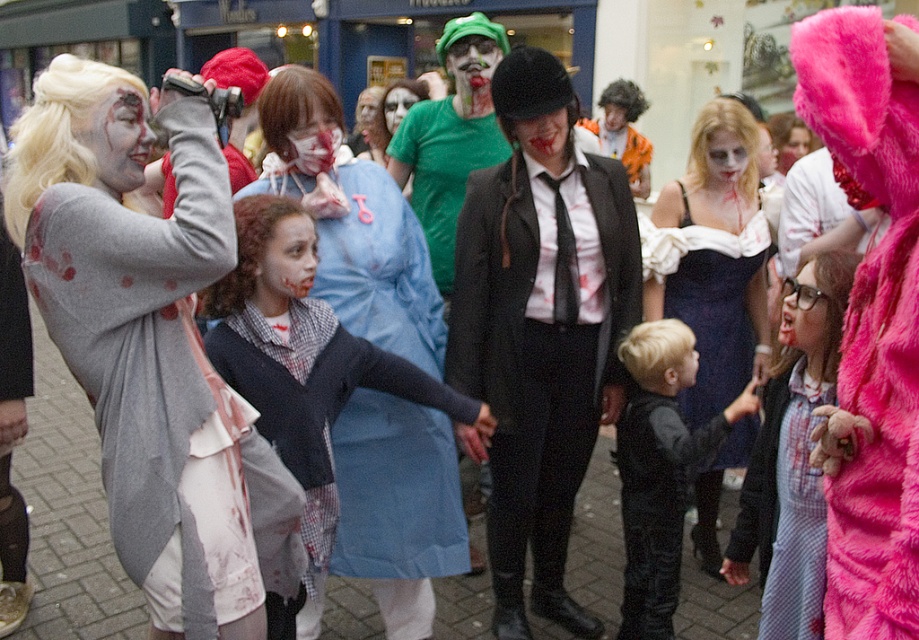
You are a costume designer assessing the space between two central costume elements in the image. The black leather vest at center and the dark brown curly wig at center. Given that the space between them is 30 cm, can you determine if the vest is wider than the wig?

The black leather vest at center is wider than the dark brown curly wig at center, so yes, the vest is wider than the wig.

You are a photographer positioned at the back of the crowd. You want to capture both the matte black suit at center and the blonde synthetic wig at center in the same frame. Which object should you focus on first to ensure both are in the frame?

The matte black suit at center is much taller than the blonde synthetic wig at center, so you should focus on the matte black suit at center first to ensure both are in the frame.